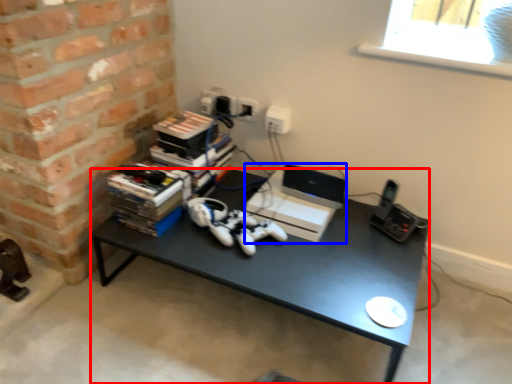
Question: Which object is further to the camera taking this photo, desk (highlighted by a red box) or computer (highlighted by a blue box)?

Choices:
 (A) desk
 (B) computer

Answer: (B)